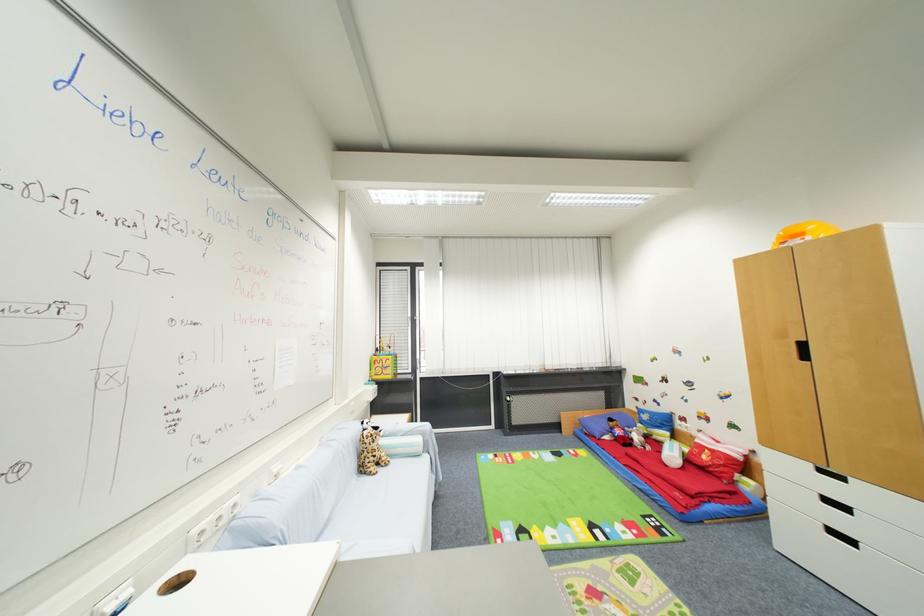
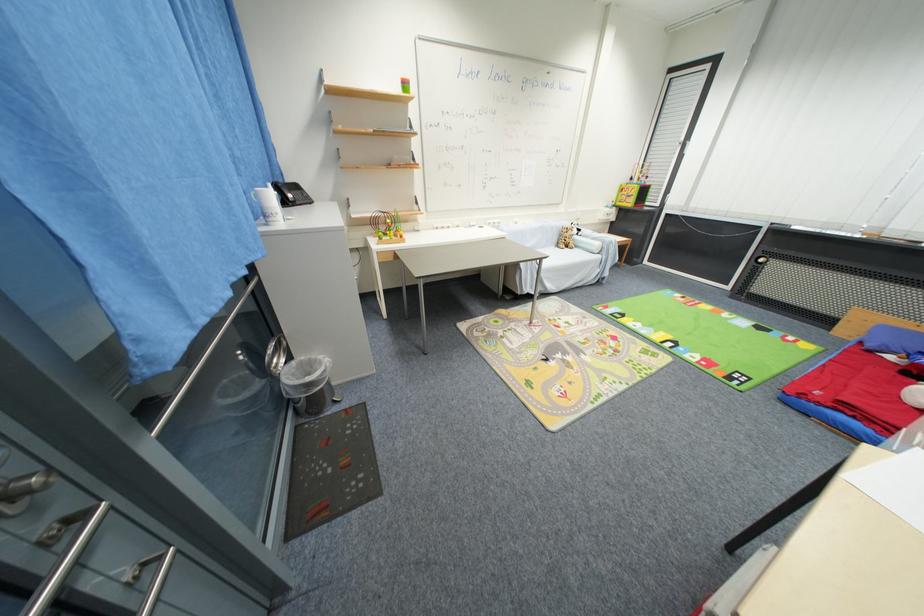
Find the pixel in the second image that matches the point at 393,377 in the first image.

(635, 206)